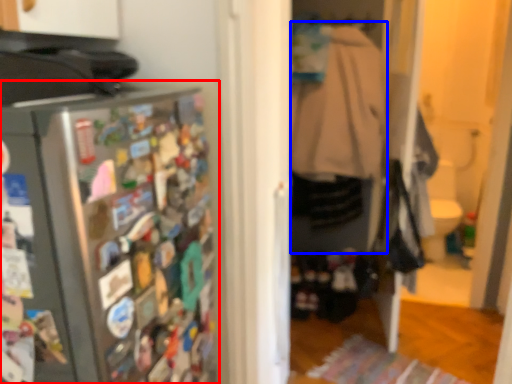
Question: Which object is closer to the camera taking this photo, refrigerator (highlighted by a red box) or clothing (highlighted by a blue box)?

Choices:
 (A) refrigerator
 (B) clothing

Answer: (A)